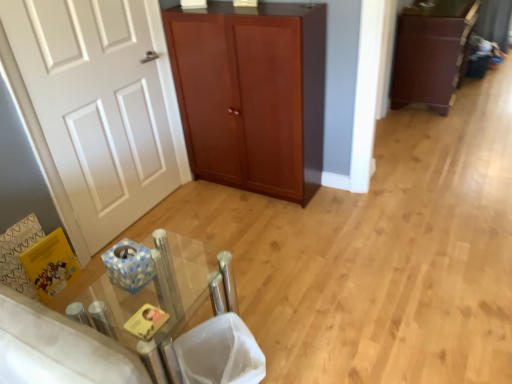
What is the approximate width of clear glass table at center?

clear glass table at center is 14.04 inches wide.

Measure the distance between point (160, 162) and camera.

They are 8.31 feet apart.

Find the location of a particular element. dark brown wood cabinet at right is located at coordinates (431, 52).

The image size is (512, 384). In order to click on clear glass table at center in this screenshot , I will do `click(111, 322)`.

Consider the image. Considering the positions of objects white mesh laundry basket at lower center and dark brown wood cabinet at right in the image provided, who is more to the right, white mesh laundry basket at lower center or dark brown wood cabinet at right?

Positioned to the right is dark brown wood cabinet at right.

Is white mesh laundry basket at lower center positioned beyond the bounds of dark brown wood cabinet at right?

Yes, white mesh laundry basket at lower center is outside of dark brown wood cabinet at right.

Are white mesh laundry basket at lower center and dark brown wood cabinet at right located far from each other?

white mesh laundry basket at lower center is far away from dark brown wood cabinet at right.

From a real-world perspective, between clear glass table at center and mahogany wood cupboard at center, who is vertically lower?

In real-world perspective, clear glass table at center is lower.

Looking at their sizes, would you say clear glass table at center is wider or thinner than mahogany wood cupboard at center?

Clearly, clear glass table at center has more width compared to mahogany wood cupboard at center.

Is clear glass table at center aimed at mahogany wood cupboard at center?

No, clear glass table at center is not aimed at mahogany wood cupboard at center.

Between clear glass table at center and mahogany wood cupboard at center, which one is positioned behind?

mahogany wood cupboard at center is more distant.

Is white matte door at left completely or partially outside of white mesh laundry basket at lower center?

Indeed, white matte door at left is completely outside white mesh laundry basket at lower center.

From the image's perspective, is white matte door at left above or below white mesh laundry basket at lower center?

white matte door at left is situated higher than white mesh laundry basket at lower center in the image.

Based on the photo, does white matte door at left turn towards white mesh laundry basket at lower center?

No, white matte door at left does not turn towards white mesh laundry basket at lower center.

Considering the sizes of objects white matte door at left and white mesh laundry basket at lower center in the image provided, who is bigger, white matte door at left or white mesh laundry basket at lower center?

white matte door at left is bigger.

Is white matte door at left at the back of dark brown wood cabinet at right?

That's not correct — dark brown wood cabinet at right is not looking away from white matte door at left.

Looking at this image, which point is more forward, (447, 99) or (35, 46)?

Point (35, 46)

Considering the sizes of objects dark brown wood cabinet at right and white matte door at left in the image provided, who is smaller, dark brown wood cabinet at right or white matte door at left?

With smaller size is white matte door at left.

In the image, is clear glass table at center positioned in front of or behind dark brown wood cabinet at right?

Visually, clear glass table at center is located in front of dark brown wood cabinet at right.

From the picture: Can we say clear glass table at center lies outside dark brown wood cabinet at right?

clear glass table at center lies outside dark brown wood cabinet at right's area.

From a real-world perspective, is clear glass table at center below dark brown wood cabinet at right?

Yes, from a real-world perspective, clear glass table at center is beneath dark brown wood cabinet at right.

From the image's perspective, would you say clear glass table at center is positioned over dark brown wood cabinet at right?

No, from the image's perspective, clear glass table at center is not on top of dark brown wood cabinet at right.

Would you say mahogany wood cupboard at center is part of dark brown wood cabinet at right's contents?

That's incorrect, mahogany wood cupboard at center is not inside dark brown wood cabinet at right.

Does dark brown wood cabinet at right turn towards mahogany wood cupboard at center?

No, dark brown wood cabinet at right is not oriented towards mahogany wood cupboard at center.

Is dark brown wood cabinet at right taller or shorter than mahogany wood cupboard at center?

In the image, dark brown wood cabinet at right appears to be shorter than mahogany wood cupboard at center.

Which is more to the right, dark brown wood cabinet at right or mahogany wood cupboard at center?

dark brown wood cabinet at right.

Is white matte door at left positioned with its back to mahogany wood cupboard at center?

No.

Considering the sizes of white matte door at left and mahogany wood cupboard at center in the image, is white matte door at left bigger or smaller than mahogany wood cupboard at center?

In the image, white matte door at left appears to be smaller than mahogany wood cupboard at center.

From a real-world perspective, which is physically above, white matte door at left or mahogany wood cupboard at center?

white matte door at left is physically above.

Which object is positioned more to the right, white matte door at left or mahogany wood cupboard at center?

mahogany wood cupboard at center is more to the right.

This screenshot has width=512, height=384. In order to click on cabinetry behind the white mesh laundry basket at lower center in this screenshot , I will do `click(431, 52)`.

Identify the location of table located on the left of mahogany wood cupboard at center. (111, 322).

Estimate the real-world distances between objects in this image. Which object is further from white mesh laundry basket at lower center, mahogany wood cupboard at center or dark brown wood cabinet at right?

The object further to white mesh laundry basket at lower center is dark brown wood cabinet at right.

Based on their spatial positions, is white mesh laundry basket at lower center or dark brown wood cabinet at right further from clear glass table at center?

dark brown wood cabinet at right lies further to clear glass table at center than the other object.

When comparing their distances from clear glass table at center, does mahogany wood cupboard at center or white mesh laundry basket at lower center seem further?

mahogany wood cupboard at center lies further to clear glass table at center than the other object.

From the image, which object appears to be nearer to clear glass table at center, dark brown wood cabinet at right or mahogany wood cupboard at center?

Based on the image, mahogany wood cupboard at center appears to be nearer to clear glass table at center.

Looking at the image, which one is located closer to mahogany wood cupboard at center, dark brown wood cabinet at right or white mesh laundry basket at lower center?

Among the two, white mesh laundry basket at lower center is located nearer to mahogany wood cupboard at center.

Considering their positions, is mahogany wood cupboard at center positioned further to dark brown wood cabinet at right than clear glass table at center?

The object further to dark brown wood cabinet at right is clear glass table at center.

From the picture: Looking at the image, which one is located closer to white matte door at left, dark brown wood cabinet at right or white mesh laundry basket at lower center?

white mesh laundry basket at lower center is positioned closer to the anchor white matte door at left.

Looking at the image, which one is located closer to mahogany wood cupboard at center, clear glass table at center or dark brown wood cabinet at right?

clear glass table at center.

You are a GUI agent. You are given a task and a screenshot of the screen. Output one action in this format:
    pyautogui.click(x=<x>, y=<y>)
    Task: Click on the laundry basket between clear glass table at center and dark brown wood cabinet at right along the z-axis
    The height and width of the screenshot is (384, 512).
    Given the screenshot: What is the action you would take?
    pyautogui.click(x=220, y=352)

The image size is (512, 384). Find the location of `cupboard between clear glass table at center and dark brown wood cabinet at right in the horizontal direction`. cupboard between clear glass table at center and dark brown wood cabinet at right in the horizontal direction is located at coordinates (252, 94).

This screenshot has width=512, height=384. What are the coordinates of `laundry basket between white matte door at left and dark brown wood cabinet at right in the horizontal direction` in the screenshot? It's located at (220, 352).

Find the location of a particular element. door between mahogany wood cupboard at center and clear glass table at center from top to bottom is located at coordinates (101, 105).